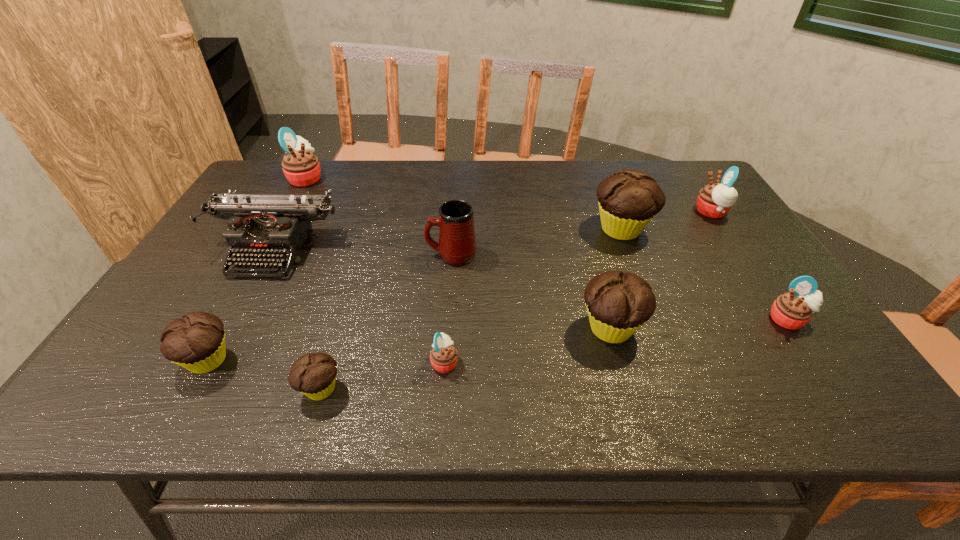
You are a GUI agent. You are given a task and a screenshot of the screen. Output one action in this format:
    pyautogui.click(x=<x>, y=<y>)
    Task: Click on the biggest pink muffin
    Image resolution: width=960 pixels, height=540 pixels.
    Given the screenshot: What is the action you would take?
    pyautogui.click(x=301, y=168)

Where is `the leftmost pink muffin`? the leftmost pink muffin is located at coordinates (301, 168).

At what (x,y) coordinates should I click in order to perform the action: click on the farthest chocolate muffin. Please return your answer as a coordinate pair (x, y). Image resolution: width=960 pixels, height=540 pixels. Looking at the image, I should click on (628, 200).

Identify the location of the third smallest pink muffin. The image size is (960, 540). (714, 200).

Locate an element on the screen. mug is located at coordinates (457, 243).

Where is `typewriter`? This screenshot has height=540, width=960. typewriter is located at coordinates (260, 226).

Locate an element on the screen. The width and height of the screenshot is (960, 540). the second biggest chocolate muffin is located at coordinates (618, 304).

Identify the location of the second smallest pink muffin. The height and width of the screenshot is (540, 960). (793, 310).

At what (x,y) coordinates should I click in order to perform the action: click on the third biggest chocolate muffin. Please return your answer as a coordinate pair (x, y). This screenshot has width=960, height=540. Looking at the image, I should click on (196, 342).

Where is `the second pink muffin from left to right`? the second pink muffin from left to right is located at coordinates (443, 356).